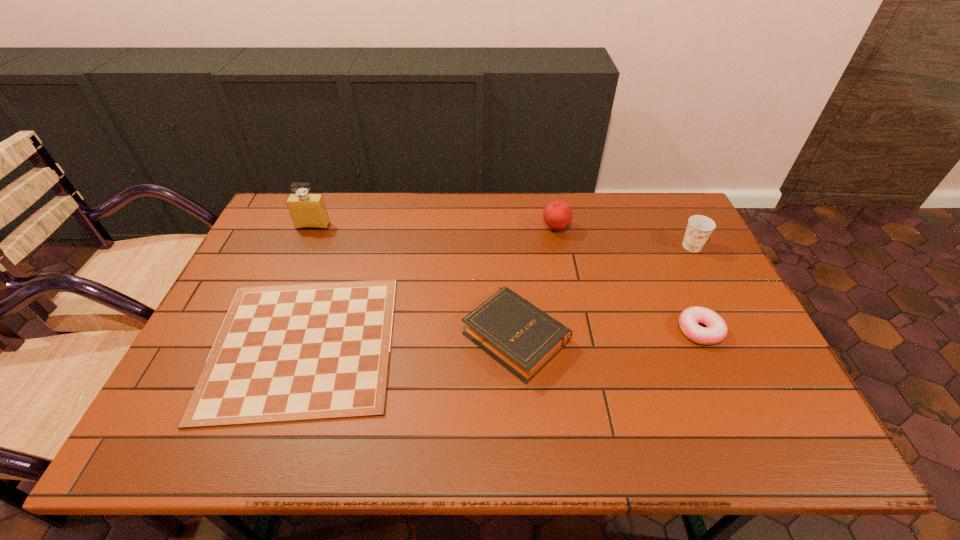
Where is `free location that satisfies the following two spatial constraints: 1. on the front-facing side of the doughnut; 2. on the right side of the tallest object`? The width and height of the screenshot is (960, 540). free location that satisfies the following two spatial constraints: 1. on the front-facing side of the doughnut; 2. on the right side of the tallest object is located at coordinates (269, 330).

Image resolution: width=960 pixels, height=540 pixels. Identify the location of free space that satisfies the following two spatial constraints: 1. on the front-facing side of the Bible; 2. on the right side of the perfume. (267, 335).